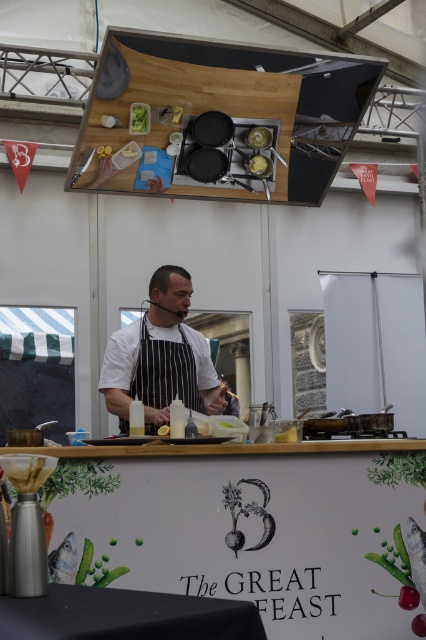
Image resolution: width=426 pixels, height=640 pixels. Describe the element at coordinates (161, 356) in the screenshot. I see `white striped apron at center` at that location.

Does white striped apron at center appear on the right side of yellow matte cheese at upper center?

Incorrect, white striped apron at center is not on the right side of yellow matte cheese at upper center.

Who is more distant from viewer, [187,288] or [259,173]?

The point [187,288] is behind.

At what (x,y) coordinates should I click in order to perform the action: click on white striped apron at center. Please return your answer as a coordinate pair (x, y). This screenshot has height=640, width=426. Looking at the image, I should click on (161, 356).

Who is lower down, yellow matte cheese at upper center or green leafy vegetable at upper center?

yellow matte cheese at upper center is below.

Between yellow matte cheese at upper center and green leafy vegetable at upper center, which one has more height?

Standing taller between the two is green leafy vegetable at upper center.

Who is more distant from viewer, (256, 156) or (138, 124)?

The point (256, 156) is behind.

This screenshot has height=640, width=426. Identify the location of yellow matte cheese at upper center. (259, 164).

Does yellow matte cheese at upper center have a larger size compared to yellow matte lemon at center?

Yes, yellow matte cheese at upper center is bigger than yellow matte lemon at center.

Between yellow matte cheese at upper center and yellow matte lemon at center, which one appears on the left side from the viewer's perspective?

From the viewer's perspective, yellow matte lemon at center appears more on the left side.

Identify the location of yellow matte cheese at upper center. Image resolution: width=426 pixels, height=640 pixels. (259, 164).